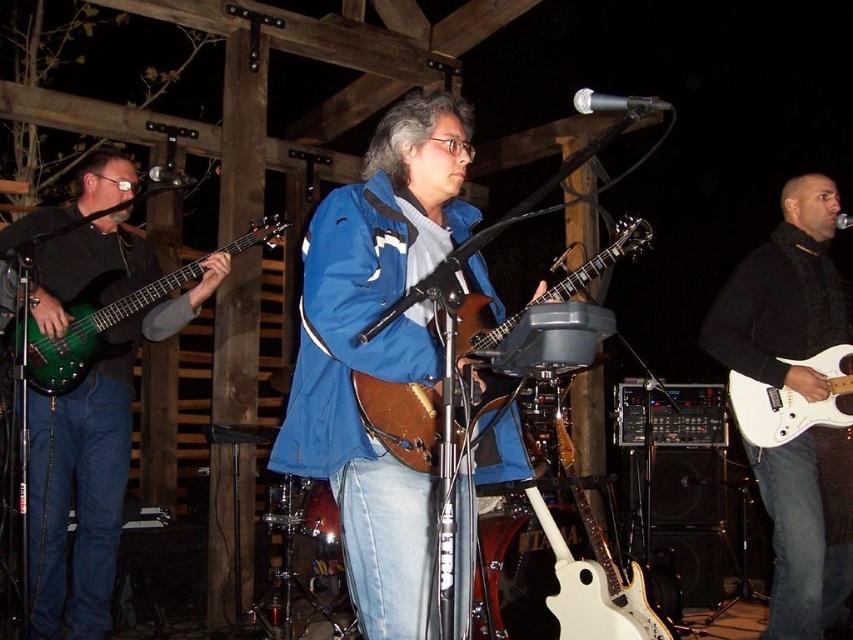
You are a photographer at the back of the stage and want to take a picture of both the green glossy bass guitar at left and the white glossy electric guitar at right. Which guitar should you adjust your camera focus to first to ensure it appears in the foreground?

The green glossy bass guitar at left should be focused on first since it is positioned on the left side of the white glossy electric guitar at right, meaning it is closer to the photographer at the back of the stage.

You are a photographer at the live music event and want to capture a photo of both the white matte electric guitar at right and the brown leather guitar at center. Since you want them both in the frame, which guitar should you position your camera closer to?

To include both guitars in the frame, position the camera closer to the brown leather guitar at center because the white matte electric guitar at right is to the right of it, so center positioning would allow both to be captured.

You are a stagehand setting up equipment for a concert. You have two guitars to place on the stage. The white matte electric guitar at right and the brown leather guitar at center. Which guitar has a smaller width?

The white matte electric guitar at right has a smaller width than the brown leather guitar at center according to the description.